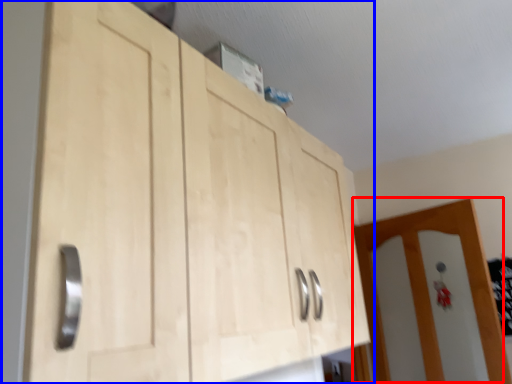
Question: Which object appears farthest to the camera in this image, door (highlighted by a red box) or cupboard (highlighted by a blue box)?

Choices:
 (A) door
 (B) cupboard

Answer: (A)